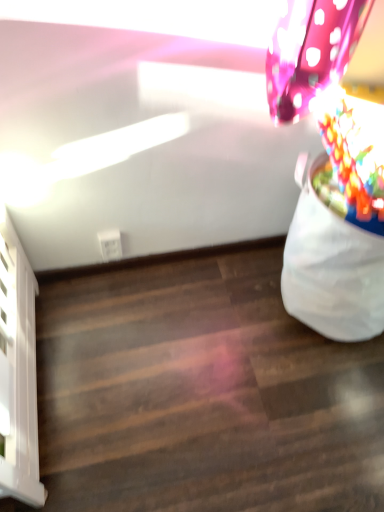
What do you see at coordinates (201, 392) in the screenshot?
I see `wooden floor at lower right` at bounding box center [201, 392].

Find the location of `multicolored plastic flower at upper right`. multicolored plastic flower at upper right is located at coordinates (355, 153).

Considering the points (312, 499) and (335, 166), which point is behind, point (312, 499) or point (335, 166)?

Point (312, 499)

Is wooden floor at lower right further to camera compared to multicolored plastic flower at upper right?

Yes, it is behind multicolored plastic flower at upper right.

In terms of width, does multicolored plastic flower at upper right look wider or thinner when compared to wooden floor at lower right?

In the image, multicolored plastic flower at upper right appears to be more narrow than wooden floor at lower right.

How different are the orientations of multicolored plastic flower at upper right and wooden floor at lower right in degrees?

There is a 92.8-degree angle between the facing directions of multicolored plastic flower at upper right and wooden floor at lower right.

Is multicolored plastic flower at upper right further to camera compared to wooden floor at lower right?

No, multicolored plastic flower at upper right is closer to the camera.

From the image's perspective, is white fabric bean bag at right under multicolored plastic flower at upper right?

Indeed, from the image's perspective, white fabric bean bag at right is shown beneath multicolored plastic flower at upper right.

Measure the distance between white fabric bean bag at right and multicolored plastic flower at upper right.

The distance of white fabric bean bag at right from multicolored plastic flower at upper right is 20.81 centimeters.

Can you confirm if white fabric bean bag at right is smaller than multicolored plastic flower at upper right?

No, white fabric bean bag at right is not smaller than multicolored plastic flower at upper right.

What's the angular difference between wooden floor at lower right and white fabric bean bag at right's facing directions?

They differ by 84.7 degrees in their facing directions.

Can you see wooden floor at lower right touching white fabric bean bag at right?

No, wooden floor at lower right is not in contact with white fabric bean bag at right.

Looking at the image, does wooden floor at lower right seem bigger or smaller compared to white fabric bean bag at right?

wooden floor at lower right is smaller than white fabric bean bag at right.

From a real-world perspective, is multicolored plastic flower at upper right above or below white fabric bean bag at right?

Clearly, from a real-world perspective, multicolored plastic flower at upper right is above white fabric bean bag at right.

From the picture: Is multicolored plastic flower at upper right oriented away from white fabric bean bag at right?

multicolored plastic flower at upper right is not turned away from white fabric bean bag at right.

Between multicolored plastic flower at upper right and white fabric bean bag at right, which one has larger width?

white fabric bean bag at right.

Is point (321, 245) positioned in front of point (85, 506)?

No, (321, 245) is behind (85, 506).

Which of these two, white fabric bean bag at right or wooden floor at lower right, is bigger?

Bigger between the two is white fabric bean bag at right.

Is white fabric bean bag at right to the right of wooden floor at lower right from the viewer's perspective?

Yes, white fabric bean bag at right is to the right of wooden floor at lower right.

Where is `flower above the wooden floor at lower right (from a real-world perspective)`? The image size is (384, 512). flower above the wooden floor at lower right (from a real-world perspective) is located at coordinates (355, 153).

I want to click on flower located above the wooden floor at lower right (from the image's perspective), so click(x=355, y=153).

Looking at the image, which one is located further to wooden floor at lower right, white fabric bean bag at right or multicolored plastic flower at upper right?

multicolored plastic flower at upper right is further to wooden floor at lower right.

From the image, which object appears to be farther from white fabric bean bag at right, wooden floor at lower right or multicolored plastic flower at upper right?

Based on the image, wooden floor at lower right appears to be further to white fabric bean bag at right.

Looking at this image, based on their spatial positions, is multicolored plastic flower at upper right or wooden floor at lower right closer to white fabric bean bag at right?

multicolored plastic flower at upper right.

In the scene shown: When comparing their distances from multicolored plastic flower at upper right, does wooden floor at lower right or white fabric bean bag at right seem closer?

white fabric bean bag at right lies closer to multicolored plastic flower at upper right than the other object.

When comparing their distances from wooden floor at lower right, does multicolored plastic flower at upper right or white fabric bean bag at right seem further?

The object further to wooden floor at lower right is multicolored plastic flower at upper right.

Which object lies further to the anchor point multicolored plastic flower at upper right, white fabric bean bag at right or wooden floor at lower right?

wooden floor at lower right is positioned further to the anchor multicolored plastic flower at upper right.

The image size is (384, 512). What are the coordinates of `bean bag chair between multicolored plastic flower at upper right and wooden floor at lower right vertically` in the screenshot? It's located at (331, 268).